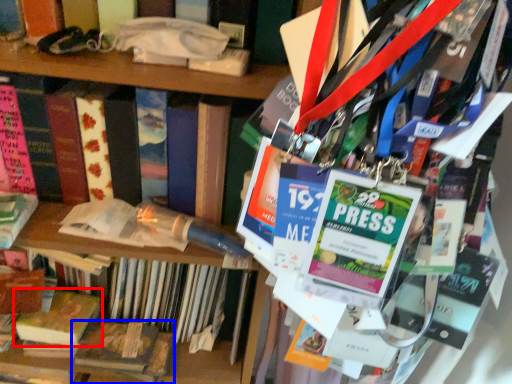
Question: Which point is further to the camera, book (highlighted by a red box) or book (highlighted by a blue box)?

Choices:
 (A) book
 (B) book

Answer: (A)